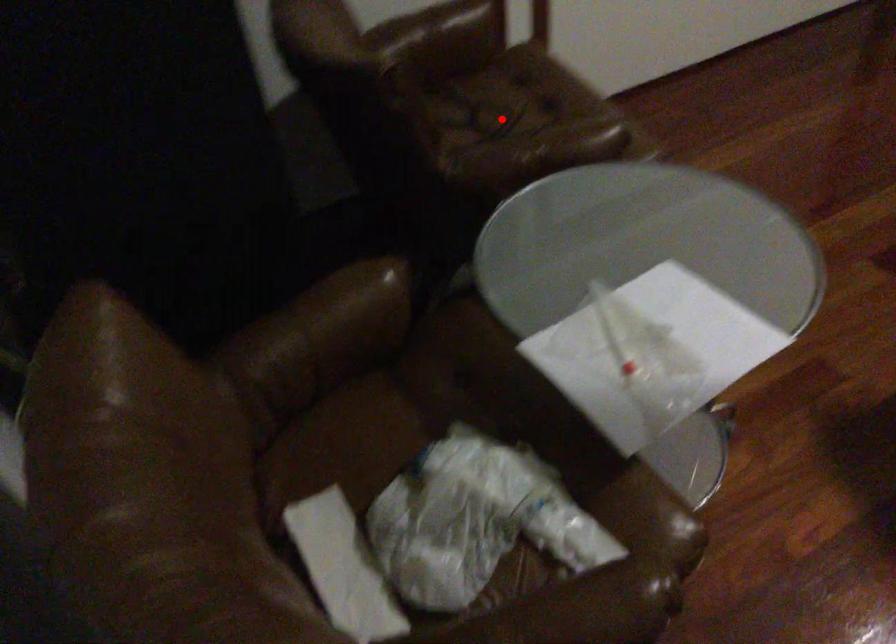
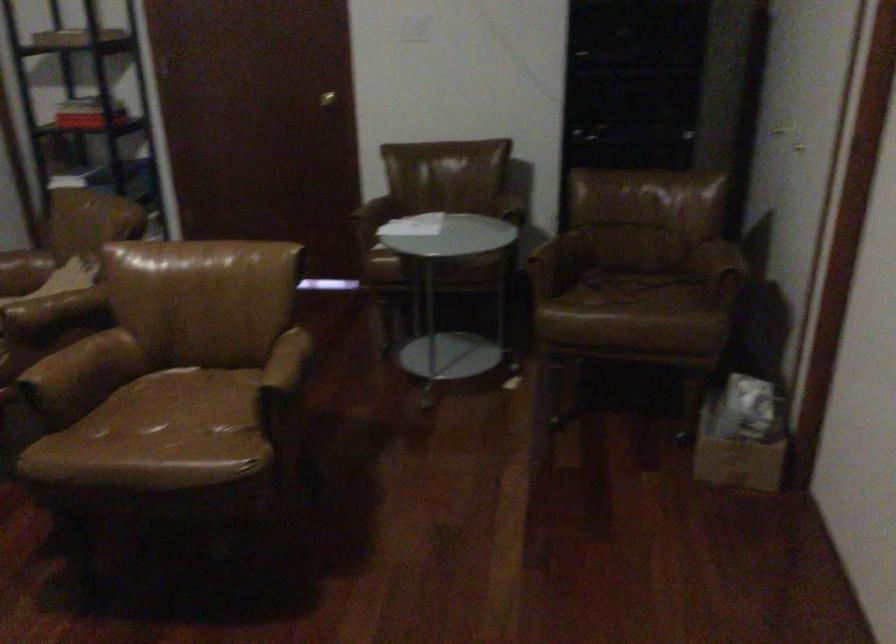
Question: I am providing you with two images of the same scene from different viewpoints. In image1, a red point is highlighted. Considering the same 3D point in image2, which of the following is correct?

Choices:
 (A) It is closer
 (B) It is farther

Answer: (B)